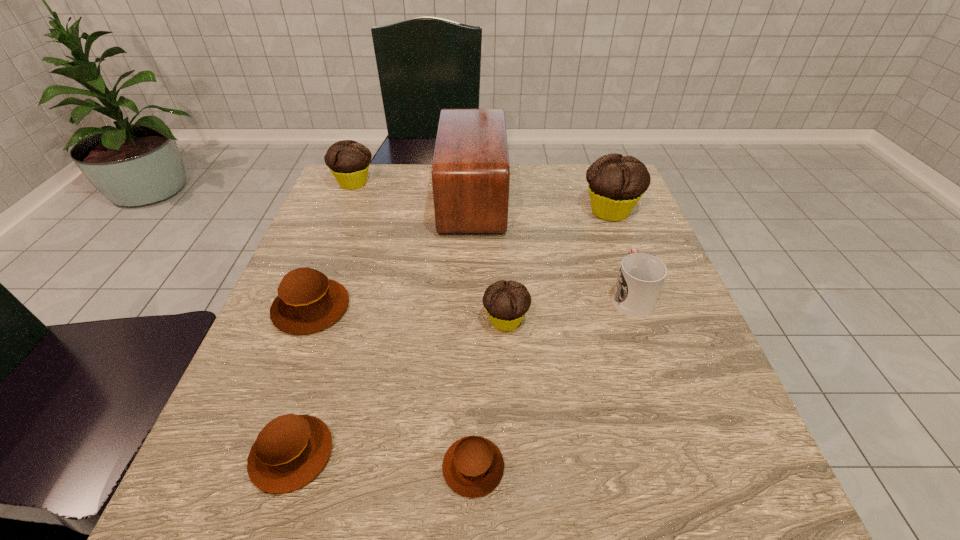
Image resolution: width=960 pixels, height=540 pixels. I want to click on blank area located on the back of the second chocolate muffin from right to left, so click(x=502, y=259).

This screenshot has height=540, width=960. In order to click on vacant space situated 0.270m on the back of the second shortest object in this screenshot , I will do `click(343, 296)`.

Where is `vacant point located on the left of the shortest object`? vacant point located on the left of the shortest object is located at coordinates (215, 467).

Identify the location of radio receiver positioned at the far edge. (470, 170).

In order to click on muffin that is at the right edge in this screenshot , I will do `click(616, 183)`.

The height and width of the screenshot is (540, 960). I want to click on cup that is at the right edge, so click(x=641, y=276).

You are a GUI agent. You are given a task and a screenshot of the screen. Output one action in this format:
    pyautogui.click(x=<x>, y=<y>)
    Task: Click on the object that is at the far left corner
    The image size is (960, 540).
    Given the screenshot: What is the action you would take?
    pyautogui.click(x=348, y=160)

Locate an element on the screen. This screenshot has width=960, height=540. object that is at the near left corner is located at coordinates (290, 451).

Locate an element on the screen. This screenshot has height=540, width=960. object that is at the far right corner is located at coordinates (616, 183).

Image resolution: width=960 pixels, height=540 pixels. In the image, there is a desktop. Find the location of `free space at the far edge`. free space at the far edge is located at coordinates (542, 200).